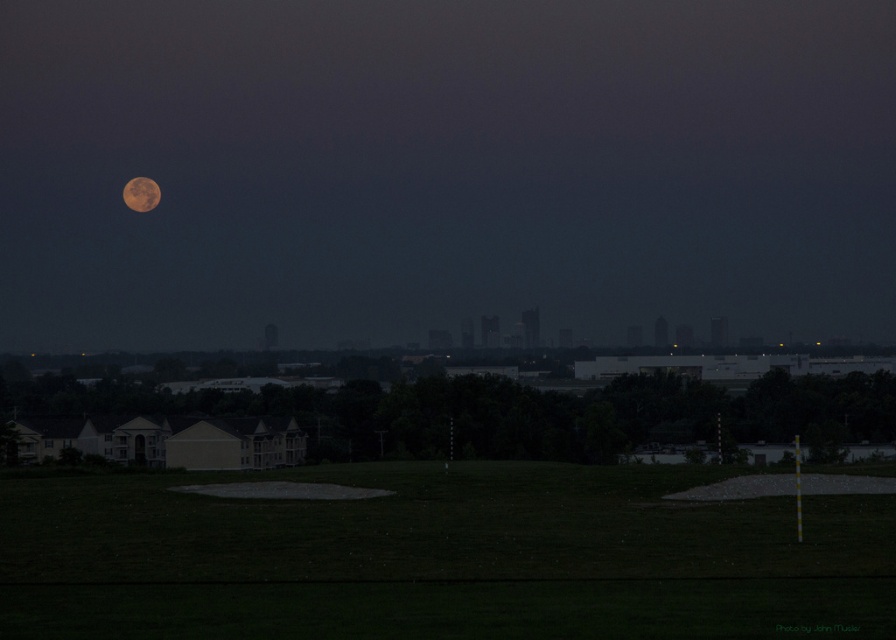
Question: Can you confirm if green grassy field at lower center is thinner than orange textured moon at upper left?

Choices:
 (A) yes
 (B) no

Answer: (B)

Question: Which point is farther to the camera?

Choices:
 (A) (128, 205)
 (B) (177, 541)

Answer: (A)

Question: From the image, what is the correct spatial relationship of green grassy field at lower center in relation to orange textured moon at upper left?

Choices:
 (A) above
 (B) below

Answer: (B)

Question: Does green grassy field at lower center appear on the right side of orange textured moon at upper left?

Choices:
 (A) no
 (B) yes

Answer: (B)